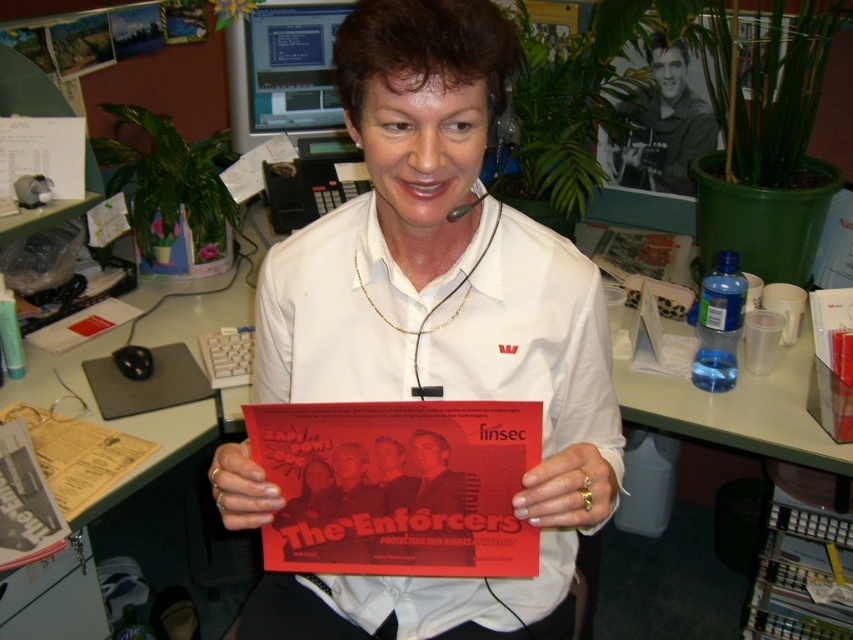
You are standing at the desk in the office scene. There are two points marked on the desk. The first point is at coordinates point (831, 602) and the second is at point (247, 512). If you want to place a small item on the desk such that it is closer to the second point than the first, where should you place it?

To place the item closer to point (247, 512) than point (831, 602), you should position it near the second point since it is closer to the front edge of the desk compared to the first point which is further back.